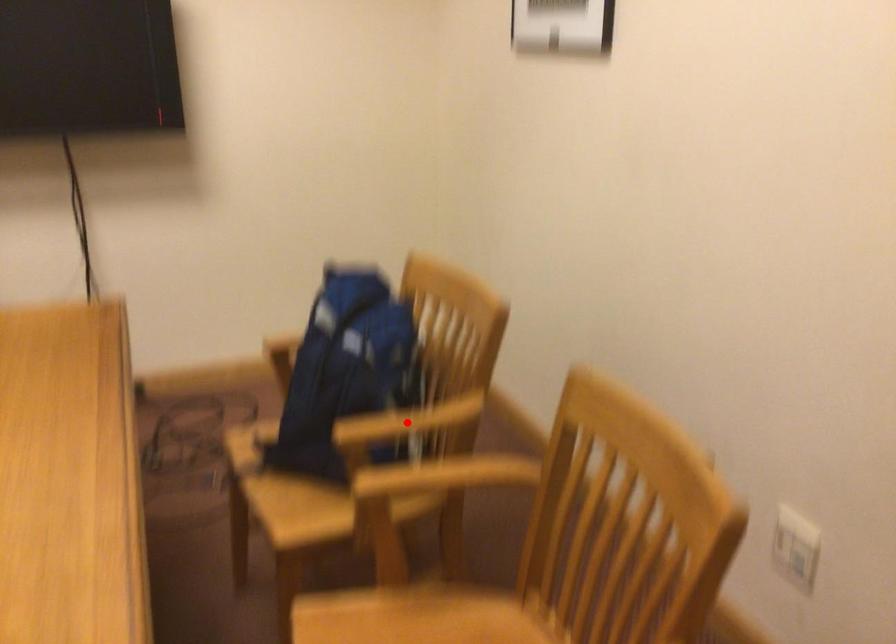
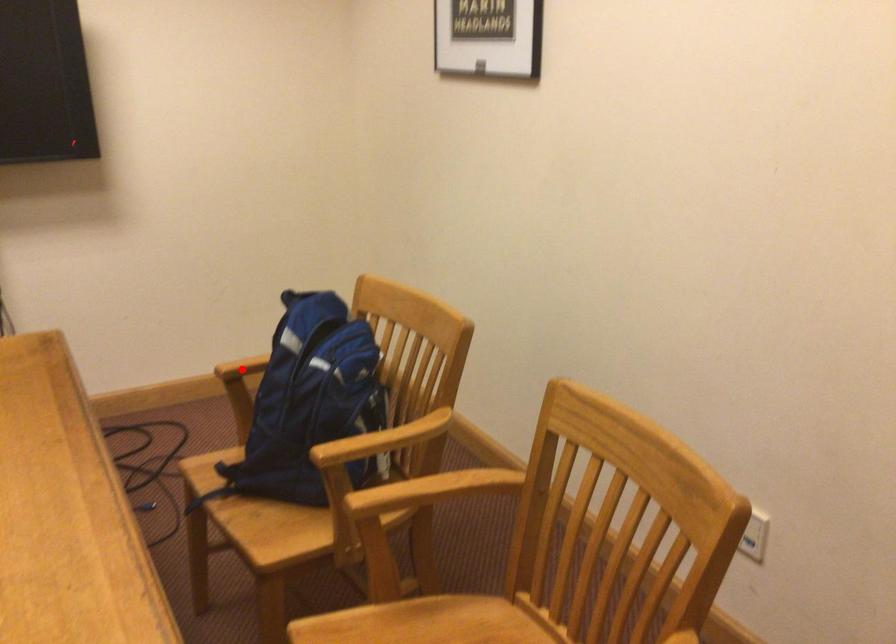
I am providing you with two images of the same scene from different viewpoints. A red point is marked on the first image and another point is marked on the second image. Are the points marked in image1 and image2 representing the same 3D position?

No